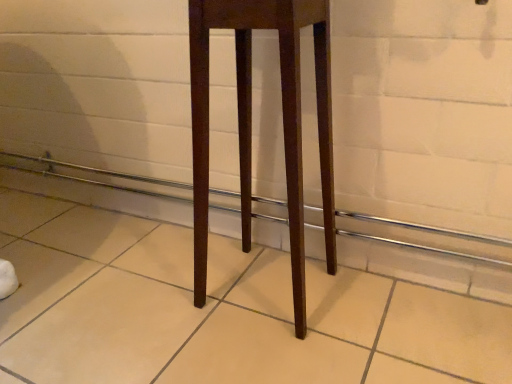
At what (x,y) coordinates should I click in order to perform the action: click on free space in front of brown wooden balustrade at center. Please return your answer as a coordinate pair (x, y). This screenshot has width=512, height=384. Looking at the image, I should click on (156, 300).